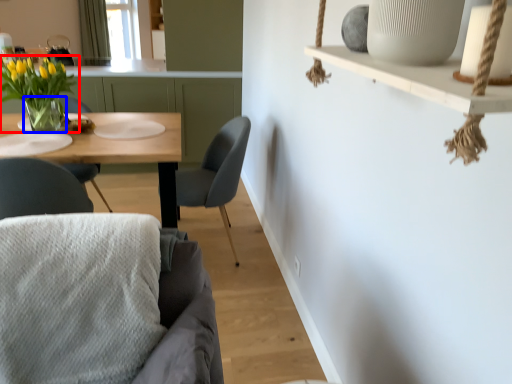
Question: Which point is further to the camera, houseplant (highlighted by a red box) or vase (highlighted by a blue box)?

Choices:
 (A) houseplant
 (B) vase

Answer: (B)